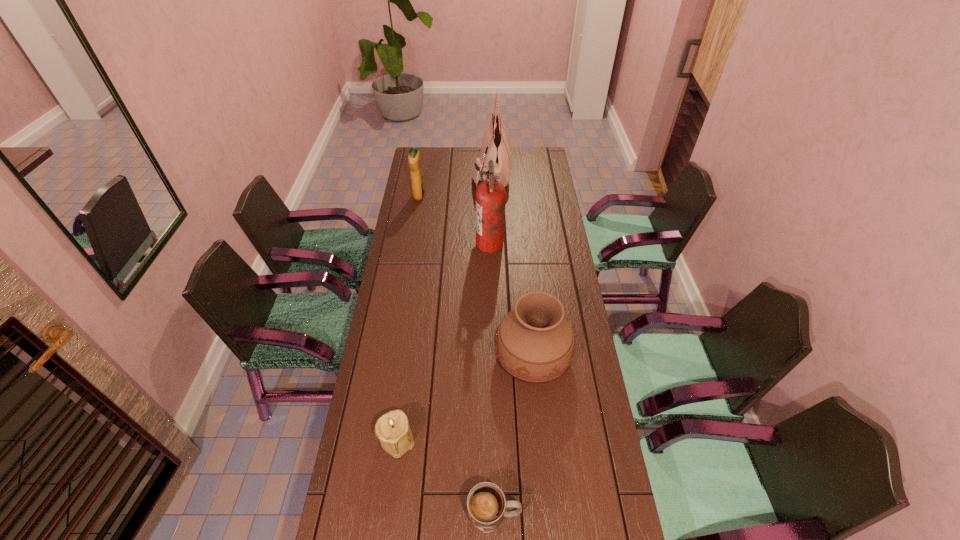
This screenshot has width=960, height=540. In order to click on vacant space in between the fire extinguisher and the third nearest object in this screenshot , I will do pyautogui.click(x=512, y=300).

Locate an element on the screen. The height and width of the screenshot is (540, 960). free area in between the fourth farthest object and the handbag is located at coordinates (512, 264).

Locate an element on the screen. unoccupied position between the urn and the candle_holder is located at coordinates (465, 397).

At what (x,y) coordinates should I click in order to perform the action: click on free space that is in between the urn and the candle_holder. Please return your answer as a coordinate pair (x, y). The width and height of the screenshot is (960, 540). Looking at the image, I should click on (465, 397).

This screenshot has width=960, height=540. Find the location of `empty location between the second nearest object and the urn`. empty location between the second nearest object and the urn is located at coordinates (465, 397).

Find the location of a particular element. Image resolution: width=960 pixels, height=540 pixels. free area in between the detergent and the second nearest object is located at coordinates (408, 318).

Locate an element on the screen. The height and width of the screenshot is (540, 960). object that can be found as the third closest to the handbag is located at coordinates tap(534, 342).

What are the coordinates of `the second closest object to the urn` in the screenshot? It's located at (486, 504).

This screenshot has height=540, width=960. In order to click on free space that satisfies the following two spatial constraints: 1. on the side of the handbag with the attached pouch; 2. on the right side of the urn in this screenshot , I will do `click(496, 356)`.

Locate an element on the screen. free point that satisfies the following two spatial constraints: 1. on the front of the urn near the operation label; 2. on the right side of the fire extinguisher is located at coordinates (492, 356).